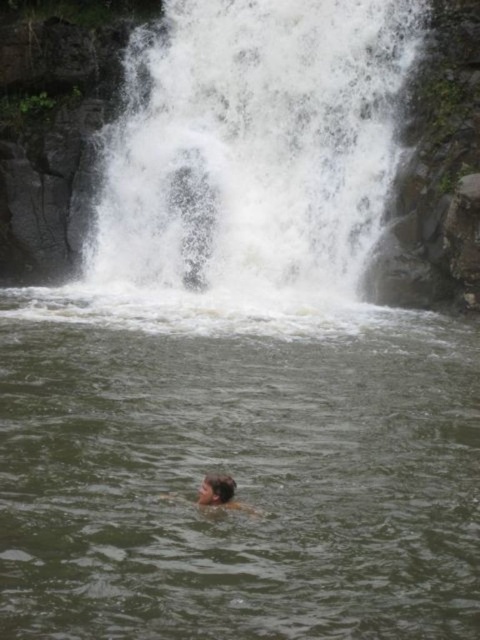
Consider the image. You are a drone operator tasked with capturing aerial footage of the waterfall. The camera is currently positioned at point A, which is at coordinates 0.230, 0.529. You need to adjust the camera to focus on the white frothy water at upper center. Is the camera already positioned correctly?

Yes, the camera is already positioned correctly because the white frothy water at upper center is located at point [253,147], which matches the camera position at point A.